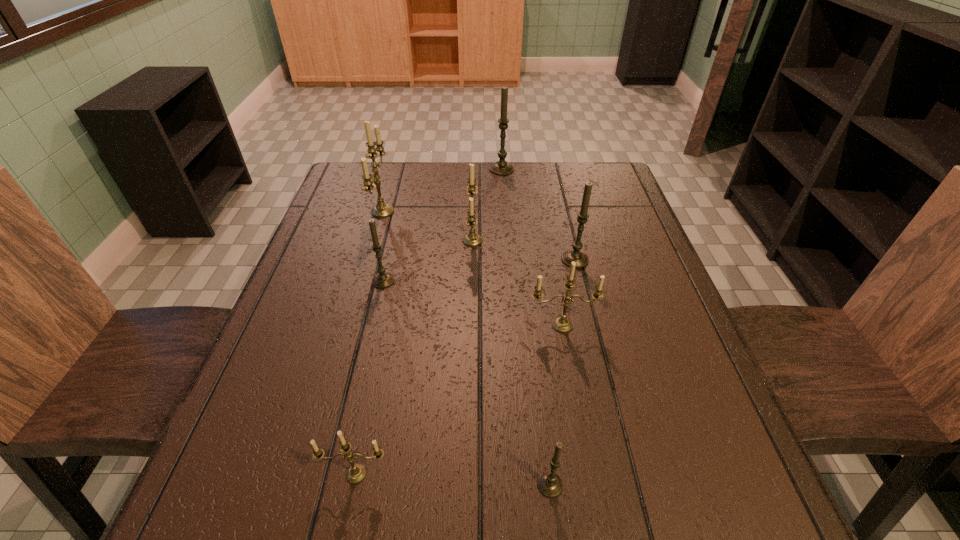
This screenshot has width=960, height=540. Find the location of `the farthest gray candle`. the farthest gray candle is located at coordinates (501, 167).

Find the location of a particular element. The image size is (960, 540). the farthest candle is located at coordinates (501, 167).

This screenshot has width=960, height=540. What are the coordinates of `the biggest metallic candle` in the screenshot? It's located at (381, 210).

The image size is (960, 540). Identify the location of the third smallest gray candle. (581, 259).

You are a GUI agent. You are given a task and a screenshot of the screen. Output one action in this format:
    pyautogui.click(x=<x>, y=<y>)
    Task: Click on the rightmost gray candle
    The width and height of the screenshot is (960, 540).
    Given the screenshot: What is the action you would take?
    pyautogui.click(x=581, y=259)

You are a GUI agent. You are given a task and a screenshot of the screen. Output one action in this format:
    pyautogui.click(x=<x>, y=<y>)
    Task: Click on the second biggest metallic candle
    
    Given the screenshot: What is the action you would take?
    pyautogui.click(x=472, y=239)

Where is `the second metallic candle from right to left`? the second metallic candle from right to left is located at coordinates (472, 239).

Identify the location of the leftmost gray candle. (383, 279).

You are a GUI agent. You are given a task and a screenshot of the screen. Output one action in this format:
    pyautogui.click(x=<x>, y=<y>)
    Task: Click on the third biggest gray candle
    
    Given the screenshot: What is the action you would take?
    pyautogui.click(x=383, y=279)

Find the location of `the third farthest metallic candle`. the third farthest metallic candle is located at coordinates (561, 324).